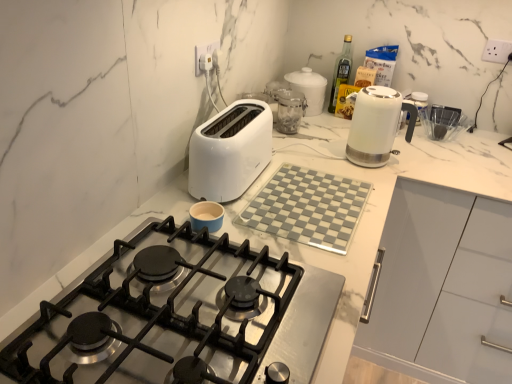
At what (x,y) coordinates should I click in order to perform the action: click on vacant area that is situated to the right of white glossy electric kettle at upper right, the third kitchen appliance from the back. Please return your answer as a coordinate pair (x, y). Image resolution: width=512 pixels, height=384 pixels. Looking at the image, I should click on (415, 159).